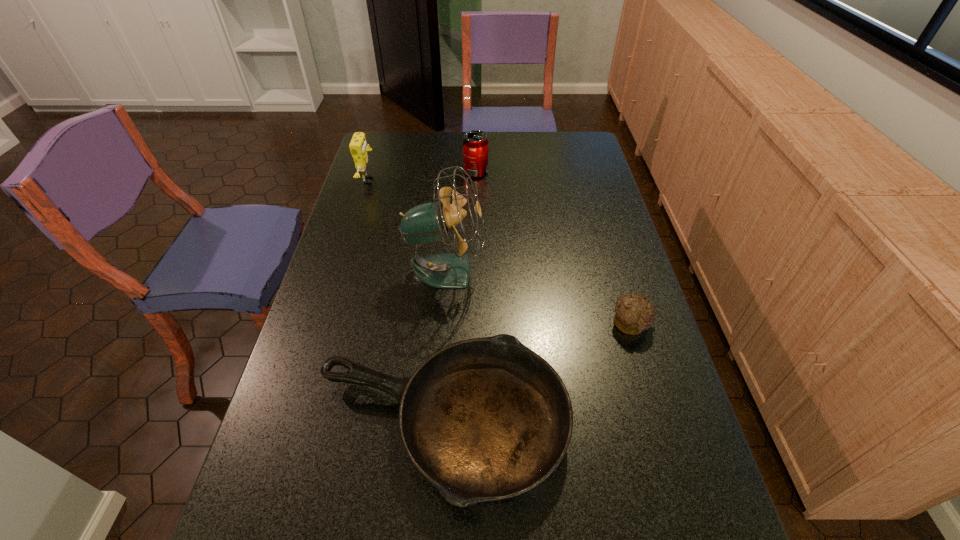
Where is `blank area located 0.320m on the back of the rightmost object`? This screenshot has width=960, height=540. blank area located 0.320m on the back of the rightmost object is located at coordinates (604, 232).

You are a GUI agent. You are given a task and a screenshot of the screen. Output one action in this format:
    pyautogui.click(x=<x>, y=<y>)
    Task: Click on the sponge at the left edge
    
    Given the screenshot: What is the action you would take?
    pyautogui.click(x=358, y=146)

Locate an element on the screen. The height and width of the screenshot is (540, 960). frying pan that is positioned at the left edge is located at coordinates (485, 419).

Identify the location of object present at the right edge. (633, 314).

The width and height of the screenshot is (960, 540). In the image, there is a desktop. Find the location of `vacant space at the far edge`. vacant space at the far edge is located at coordinates (498, 137).

Find the location of a particular element. This screenshot has height=540, width=960. free space at the left edge is located at coordinates (363, 321).

Where is `free space at the right edge of the desktop`? free space at the right edge of the desktop is located at coordinates (599, 202).

At what (x,y) coordinates should I click in order to perform the action: click on vacant area at the far left corner. Please return your answer as a coordinate pair (x, y). Looking at the image, I should click on (382, 143).

This screenshot has height=540, width=960. What are the coordinates of `vacant space at the far right corner of the desktop` in the screenshot? It's located at (578, 134).

Identify the location of vacant area that lies between the nearest object and the sponge. This screenshot has width=960, height=540. (406, 302).